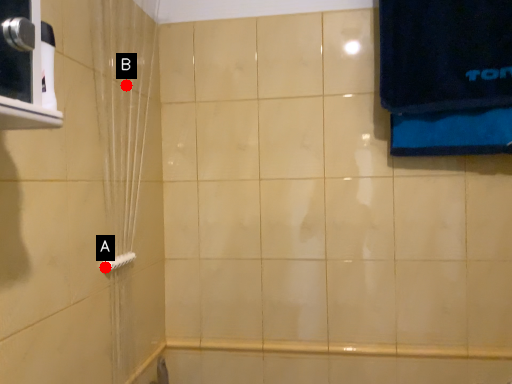
Question: Two points are circled on the image, labeled by A and B beside each circle. Which point is farther to the camera?

Choices:
 (A) A is further
 (B) B is further

Answer: (B)